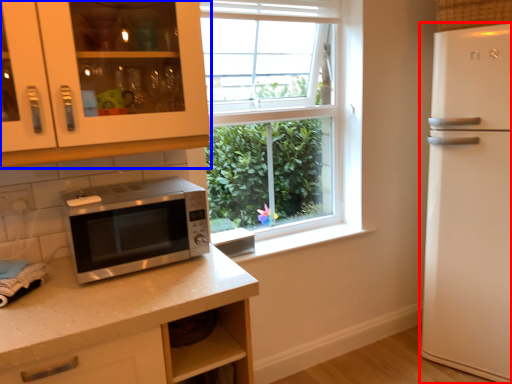
Question: Which point is further to the camera, refrigerator (highlighted by a red box) or cabinetry (highlighted by a blue box)?

Choices:
 (A) refrigerator
 (B) cabinetry

Answer: (A)